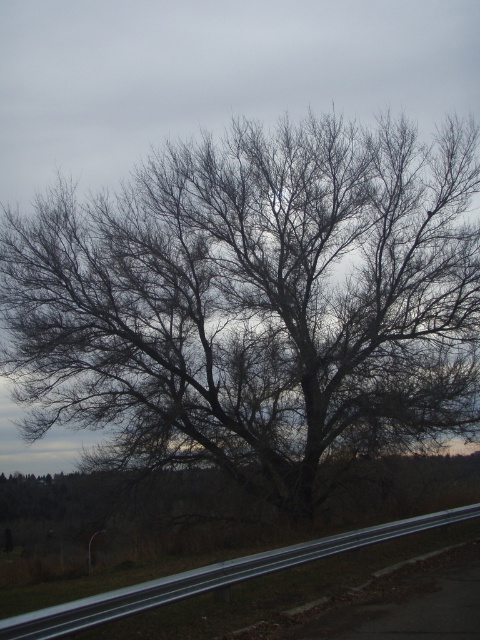
Question: Can you confirm if bare branches at center is wider than metallic gray highway at lower center?

Choices:
 (A) no
 (B) yes

Answer: (B)

Question: Can you confirm if bare branches at center is thinner than metallic gray highway at lower center?

Choices:
 (A) no
 (B) yes

Answer: (A)

Question: Is bare branches at center to the left of metallic gray highway at lower center from the viewer's perspective?

Choices:
 (A) no
 (B) yes

Answer: (B)